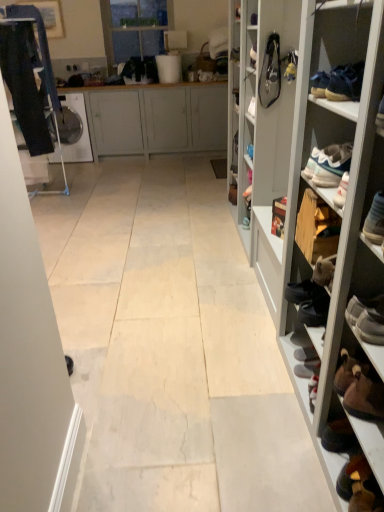
This screenshot has width=384, height=512. What do you see at coordinates (25, 84) in the screenshot?
I see `dark blue jeans at left` at bounding box center [25, 84].

What are the coordinates of `wooden shoe rack at right` in the screenshot? It's located at (316, 199).

Image resolution: width=384 pixels, height=512 pixels. In order to click on transparent glass door at upper center in this screenshot , I will do `click(134, 28)`.

Image resolution: width=384 pixels, height=512 pixels. What do you see at coordinates (270, 73) in the screenshot? I see `leather bag at upper right, acting as the first shoe starting from the left` at bounding box center [270, 73].

Where is `matte gray cabinet at center`? Image resolution: width=384 pixels, height=512 pixels. matte gray cabinet at center is located at coordinates click(157, 120).

From the picture: Is leather bag at upper right, marked as the second shoe in a right-to-left arrangement, a part of yellow fabric shoe at upper right, the second shoe in the left-to-right sequence?

No, yellow fabric shoe at upper right, the second shoe in the left-to-right sequence, does not contain leather bag at upper right, marked as the second shoe in a right-to-left arrangement.

Which object is thinner, yellow fabric shoe at upper right, arranged as the 1th shoe when viewed from the right, or leather bag at upper right, acting as the first shoe starting from the left?

yellow fabric shoe at upper right, arranged as the 1th shoe when viewed from the right, is thinner.

Is yellow fabric shoe at upper right, arranged as the 1th shoe when viewed from the right, next to leather bag at upper right, acting as the first shoe starting from the left?

Yes, yellow fabric shoe at upper right, arranged as the 1th shoe when viewed from the right, is with leather bag at upper right, acting as the first shoe starting from the left.

Is wooden shoe rack at right surrounding leather bag at upper right, acting as the first shoe starting from the left?

Yes, leather bag at upper right, acting as the first shoe starting from the left, is a part of wooden shoe rack at right.

Is wooden shoe rack at right turned away from leather bag at upper right, acting as the first shoe starting from the left?

Yes, leather bag at upper right, acting as the first shoe starting from the left, is at the back of wooden shoe rack at right.

The height and width of the screenshot is (512, 384). Identify the location of shoe that is the 1st object above the wooden shoe rack at right (from a real-world perspective). (270, 73).

Considering the positions of objects wooden shoe rack at right and leather bag at upper right, marked as the second shoe in a right-to-left arrangement, in the image provided, who is behind, wooden shoe rack at right or leather bag at upper right, marked as the second shoe in a right-to-left arrangement,?

leather bag at upper right, marked as the second shoe in a right-to-left arrangement, is further from the camera.

Looking at this image, from the image's perspective, between dark blue jeans at left and matte gray cabinet at center, which one is located above?

matte gray cabinet at center is shown above in the image.

Which is closer to the camera, (24, 55) or (136, 150)?

Point (24, 55) appears to be closer to the viewer than point (136, 150).

In the scene shown: Is dark blue jeans at left in front of or behind matte gray cabinet at center in the image?

In the image, dark blue jeans at left appears in front of matte gray cabinet at center.

Which of these two, yellow fabric shoe at upper right, arranged as the 1th shoe when viewed from the right, or transparent glass door at upper center, is bigger?

Bigger between the two is transparent glass door at upper center.

Do you think yellow fabric shoe at upper right, arranged as the 1th shoe when viewed from the right, is within transparent glass door at upper center, or outside of it?

yellow fabric shoe at upper right, arranged as the 1th shoe when viewed from the right, is located beyond the bounds of transparent glass door at upper center.

Is point (292, 52) positioned in front of point (135, 53)?

Yes, point (292, 52) is closer to viewer.

Locate an element on the screen. The image size is (384, 512). shelf below the dark blue jeans at left (from the image's perspective) is located at coordinates (316, 199).

How different are the orientations of wooden shoe rack at right and dark blue jeans at left in degrees?

There is a 98.2-degree angle between the facing directions of wooden shoe rack at right and dark blue jeans at left.

Is wooden shoe rack at right oriented away from dark blue jeans at left?

wooden shoe rack at right does not have its back to dark blue jeans at left.

From the image's perspective, does wooden shoe rack at right appear higher than dark blue jeans at left?

No.

Which is more to the right, matte gray cabinet at center or dark blue jeans at left?

From the viewer's perspective, matte gray cabinet at center appears more on the right side.

From the picture: Does matte gray cabinet at center touch dark blue jeans at left?

No, matte gray cabinet at center is not with dark blue jeans at left.

Which object is closer to the camera taking this photo, matte gray cabinet at center or dark blue jeans at left?

dark blue jeans at left is closer to the camera.

Is dark blue jeans at left thinner than wooden shoe rack at right?

Yes, dark blue jeans at left is thinner than wooden shoe rack at right.

Locate an element on the screen. The width and height of the screenshot is (384, 512). shelf in front of the dark blue jeans at left is located at coordinates (316, 199).

Choose the correct answer: Is dark blue jeans at left inside wooden shoe rack at right or outside it?

The correct answer is: outside.

Is dark blue jeans at left taller or shorter than wooden shoe rack at right?

dark blue jeans at left is shorter than wooden shoe rack at right.

Find the location of a particular element. The width and height of the screenshot is (384, 512). shoe that is on the left side of yellow fabric shoe at upper right, arranged as the 1th shoe when viewed from the right is located at coordinates (270, 73).

Locate an element on the screen. Image resolution: width=384 pixels, height=512 pixels. shelf below the leather bag at upper right, marked as the second shoe in a right-to-left arrangement (from a real-world perspective) is located at coordinates (316, 199).

Based on their spatial positions, is dark blue jeans at left or matte gray cabinet at center further from transparent glass door at upper center?

Based on the image, dark blue jeans at left appears to be further to transparent glass door at upper center.

Which object lies nearer to the anchor point wooden shoe rack at right, transparent glass door at upper center or leather bag at upper right, marked as the second shoe in a right-to-left arrangement?

leather bag at upper right, marked as the second shoe in a right-to-left arrangement.

From the image, which object appears to be nearer to leather bag at upper right, marked as the second shoe in a right-to-left arrangement, dark blue jeans at left or yellow fabric shoe at upper right, arranged as the 1th shoe when viewed from the right?

yellow fabric shoe at upper right, arranged as the 1th shoe when viewed from the right, is closer to leather bag at upper right, marked as the second shoe in a right-to-left arrangement.

Looking at this image, based on their spatial positions, is transparent glass door at upper center or wooden shoe rack at right closer to yellow fabric shoe at upper right, the second shoe in the left-to-right sequence?

wooden shoe rack at right lies closer to yellow fabric shoe at upper right, the second shoe in the left-to-right sequence, than the other object.

Which object lies further to the anchor point wooden shoe rack at right, transparent glass door at upper center or dark blue jeans at left?

Based on the image, transparent glass door at upper center appears to be further to wooden shoe rack at right.

Looking at the image, which one is located closer to wooden shoe rack at right, dark blue jeans at left or matte gray cabinet at center?

dark blue jeans at left.

When comparing their distances from transparent glass door at upper center, does matte gray cabinet at center or yellow fabric shoe at upper right, the second shoe in the left-to-right sequence, seem closer?

The object closer to transparent glass door at upper center is matte gray cabinet at center.

When comparing their distances from yellow fabric shoe at upper right, arranged as the 1th shoe when viewed from the right, does wooden shoe rack at right or leather bag at upper right, marked as the second shoe in a right-to-left arrangement, seem further?

wooden shoe rack at right is positioned further to the anchor yellow fabric shoe at upper right, arranged as the 1th shoe when viewed from the right.

Locate an element on the screen. Image resolution: width=384 pixels, height=512 pixels. shoe between leather bag at upper right, acting as the first shoe starting from the left, and transparent glass door at upper center from front to back is located at coordinates (290, 66).

The width and height of the screenshot is (384, 512). Find the location of `shoe located between leather bag at upper right, marked as the second shoe in a right-to-left arrangement, and matte gray cabinet at center in the depth direction`. shoe located between leather bag at upper right, marked as the second shoe in a right-to-left arrangement, and matte gray cabinet at center in the depth direction is located at coordinates (290, 66).

Where is `clothing between wooden shoe rack at right and matte gray cabinet at center in the front-back direction`? clothing between wooden shoe rack at right and matte gray cabinet at center in the front-back direction is located at coordinates (25, 84).

Identify the location of cabinetry positioned between yellow fabric shoe at upper right, the second shoe in the left-to-right sequence, and transparent glass door at upper center from near to far. (157, 120).